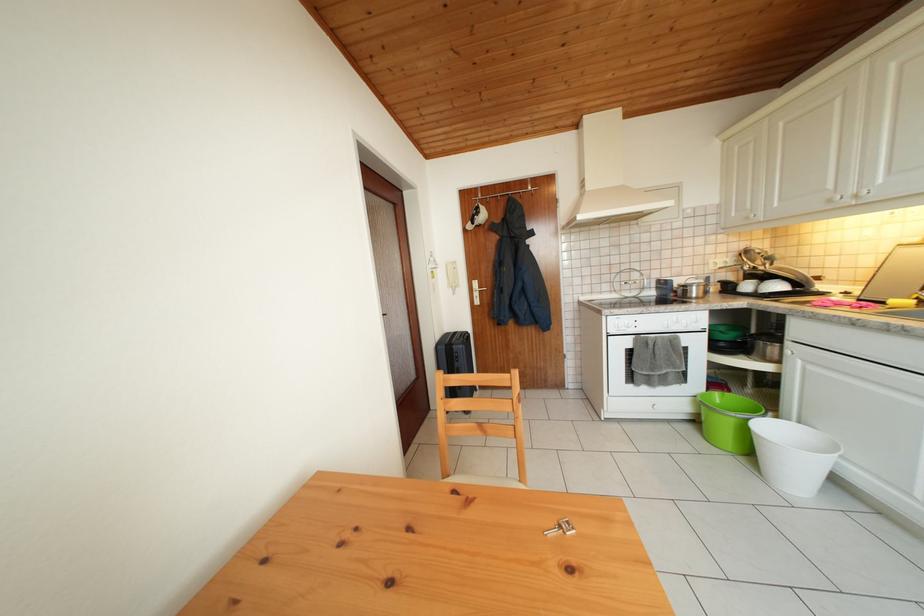
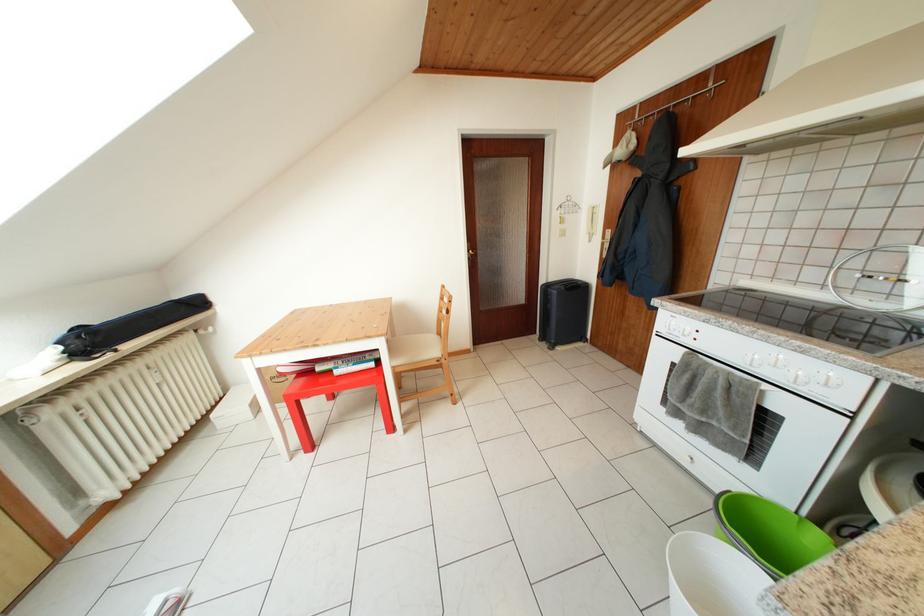
The point at (494, 193) is marked in the first image. Where is the corresponding point in the second image?

(657, 108)